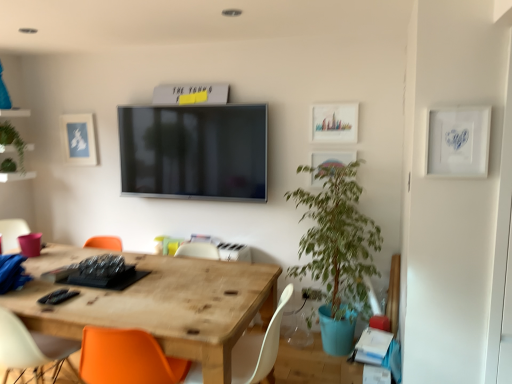
Question: Is white matte chair at lower center in front of or behind green leafy plant at left in the image?

Choices:
 (A) behind
 (B) front

Answer: (B)

Question: Looking at their shapes, would you say white matte chair at lower center is wider or thinner than green leafy plant at left?

Choices:
 (A) thin
 (B) wide

Answer: (B)

Question: Considering the real-world distances, which object is farthest from the white matte chair at lower center?

Choices:
 (A) green leafy plant in blue pot at right
 (B) wooden table at center
 (C) matte blue paper at upper left
 (D) green leafy plant at left

Answer: (D)

Question: Which of these objects is positioned closest to the green leafy plant in blue pot at right?

Choices:
 (A) green leafy plant at left
 (B) wooden table at center
 (C) white matte chair at lower center
 (D) matte blue paper at upper left

Answer: (C)